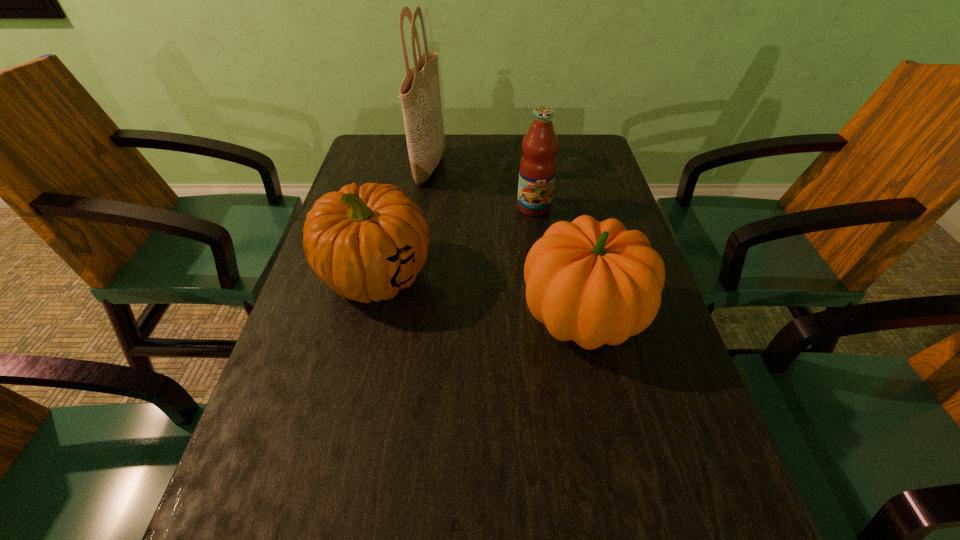
The height and width of the screenshot is (540, 960). I want to click on vacant region between the second farthest object and the tallest object, so click(x=482, y=187).

Identify the location of free area in between the third nearest object and the shopping bag. The height and width of the screenshot is (540, 960). (482, 187).

Find the location of a particular element. empty space between the fruit juice and the left pumpkin is located at coordinates (455, 242).

Where is `vacant area that lies between the left pumpkin and the third nearest object`? The height and width of the screenshot is (540, 960). vacant area that lies between the left pumpkin and the third nearest object is located at coordinates (455, 242).

Identify which object is the third closest to the right pumpkin. Please provide its 2D coordinates. Your answer should be formatted as a tuple, i.e. [(x, y)], where the tuple contains the x and y coordinates of a point satisfying the conditions above.

[(420, 97)]

Where is `object that is the second closest one to the farthest object`? object that is the second closest one to the farthest object is located at coordinates (537, 171).

Find the location of a particular element. The width and height of the screenshot is (960, 540). vacant position in the image that satisfies the following two spatial constraints: 1. on the front label of the third nearest object; 2. on the right side of the right pumpkin is located at coordinates (550, 318).